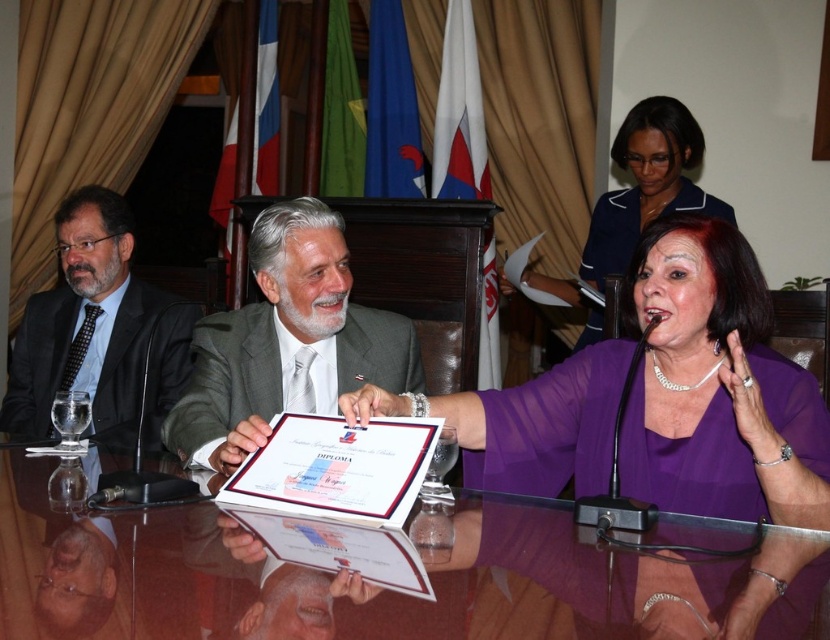
Which is in front, point (521, 577) or point (642, 419)?

Point (521, 577) is in front.

Is transparent glass table at center in front of purple satin blouse at center?

Yes, it is in front of purple satin blouse at center.

Between point (85, 470) and point (587, 438), which one is positioned in front?

Point (85, 470)

At what (x,y) coordinates should I click in order to perform the action: click on transparent glass table at center. Please return your answer as a coordinate pair (x, y). This screenshot has width=830, height=640. Looking at the image, I should click on (377, 593).

Who is higher up, matte gray suit at center or purple sheer blouse at center?

purple sheer blouse at center is above.

Does matte gray suit at center appear over purple sheer blouse at center?

No.

Image resolution: width=830 pixels, height=640 pixels. Describe the element at coordinates (287, 339) in the screenshot. I see `matte gray suit at center` at that location.

At what (x,y) coordinates should I click in order to perform the action: click on matte gray suit at center. Please return your answer as a coordinate pair (x, y). This screenshot has width=830, height=640. Looking at the image, I should click on (287, 339).

Between point (462, 445) and point (93, 348), which one is positioned behind?

The point (93, 348) is behind.

Is purple satin blouse at center closer to camera compared to black suit at left?

That is True.

Where is `purple satin blouse at center`? This screenshot has width=830, height=640. purple satin blouse at center is located at coordinates (716, 387).